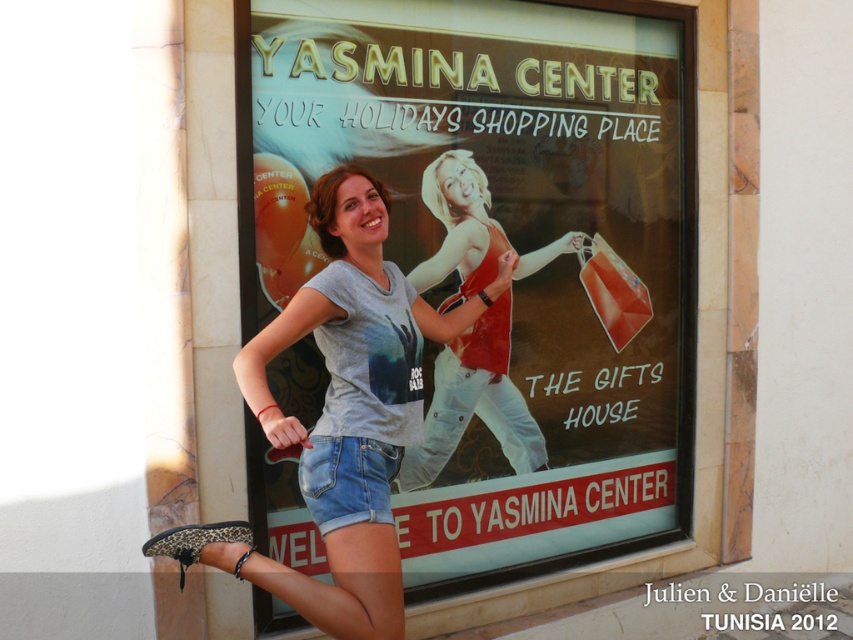
Can you confirm if gray cotton t-shirt at center is thinner than denim shorts at lower center?

In fact, gray cotton t-shirt at center might be wider than denim shorts at lower center.

How far apart are gray cotton t-shirt at center and denim shorts at lower center?

gray cotton t-shirt at center and denim shorts at lower center are 5.23 inches apart from each other.

What do you see at coordinates (350, 406) in the screenshot? This screenshot has height=640, width=853. I see `gray cotton t-shirt at center` at bounding box center [350, 406].

Image resolution: width=853 pixels, height=640 pixels. Identify the location of gray cotton t-shirt at center. (350, 406).

Who is higher up, matte plastic signboard at center or matte red tank top at center?

Positioned higher is matte plastic signboard at center.

Who is shorter, matte plastic signboard at center or matte red tank top at center?

matte red tank top at center is shorter.

Measure the distance between point [659,104] and camera.

They are 4.01 meters apart.

Locate an element on the screen. matte plastic signboard at center is located at coordinates (473, 273).

Can you confirm if matte plastic signboard at center is shorter than gray cotton t-shirt at center?

In fact, matte plastic signboard at center may be taller than gray cotton t-shirt at center.

Which is behind, point (427, 145) or point (370, 307)?

The point (427, 145) is more distant.

Where is `matte plastic signboard at center`? The width and height of the screenshot is (853, 640). matte plastic signboard at center is located at coordinates (473, 273).